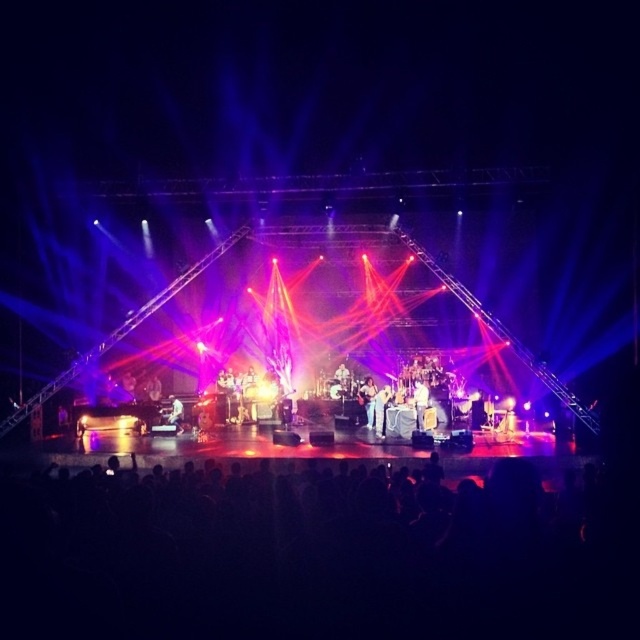
Is denim pants at center further to the viewer compared to white fabric shirt at center?

That is True.

Can you confirm if denim pants at center is smaller than white fabric shirt at center?

No, denim pants at center is not smaller than white fabric shirt at center.

Consider the image. Who is more forward, [368,378] or [177,420]?

Point [177,420]

At what (x,y) coordinates should I click in order to perform the action: click on denim pants at center. Please return your answer as a coordinate pair (x, y). Image resolution: width=640 pixels, height=640 pixels. Looking at the image, I should click on (368, 400).